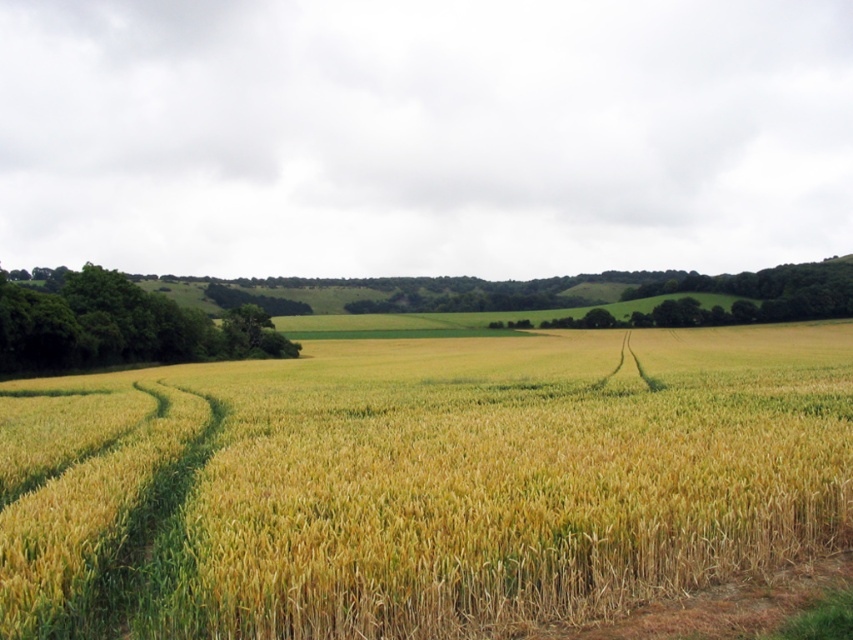
You are a farmer checking the field from a distance. You notice the yellow grainy wheat field at center and the green leafy trees at left. Which one appears to be closer to you?

The yellow grainy wheat field at center appears closer because it is smaller than the green leafy trees at left, and smaller objects often appear farther away. Wait, but the description says the wheat field is smaller than the trees. Hmm, maybe I need to think again. If the wheat is smaller in the image, but in reality, the trees are further away, then the wheat would be closer. Wait, perspective in art usually has smaller objects as further, but here the wheat is at center and trees are at left. Maybe the

You are standing at the point marked as point (422, 483) in the image. What do you see directly in front of you?

You see the yellow grainy wheat field at center directly in front of you at point (422, 483).

You are a farmer checking the growth of your crops. You notice the yellow grainy wheat field at center and the green leafy trees at left. Which one has a greater height?

The green leafy trees at left are taller than the yellow grainy wheat field at center.